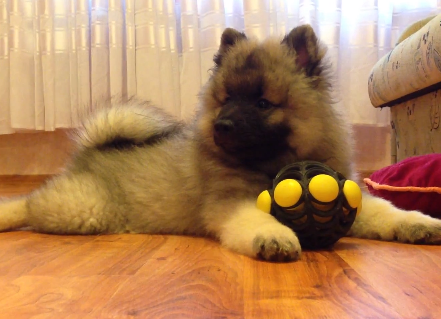
Image resolution: width=441 pixels, height=319 pixels. Identify the location of burgundy pillow. (409, 180).